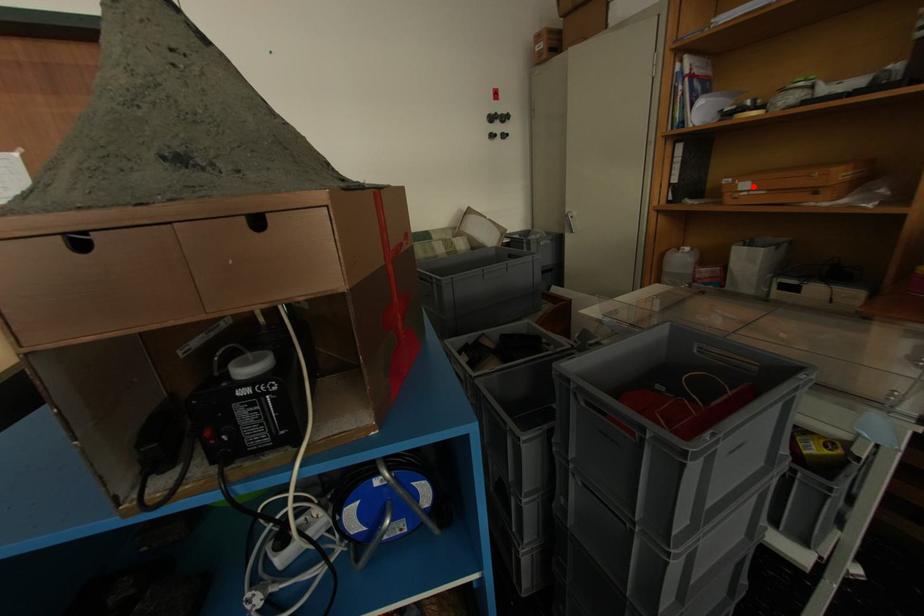
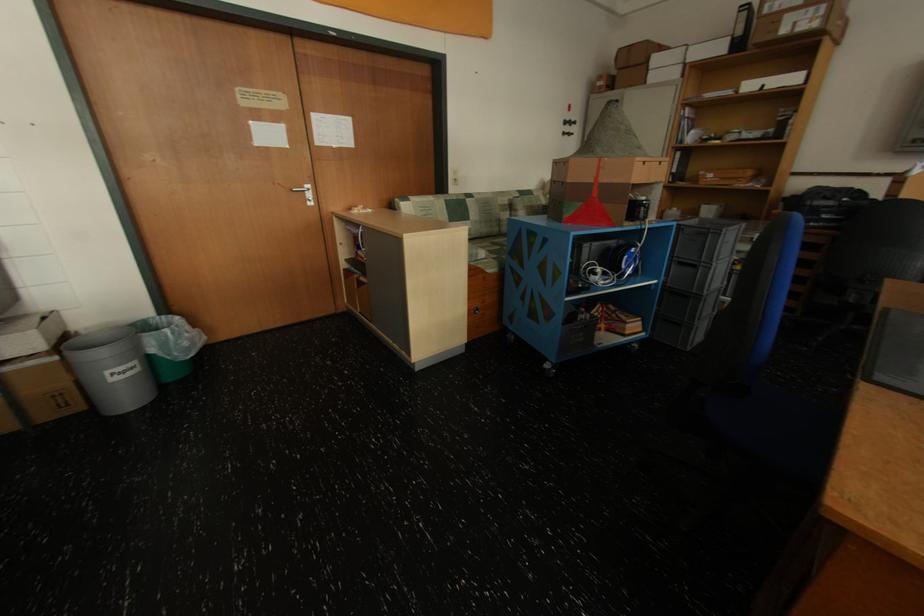
The point at the highlighted location is marked in the first image. Where is the corresponding point in the second image?

(719, 177)